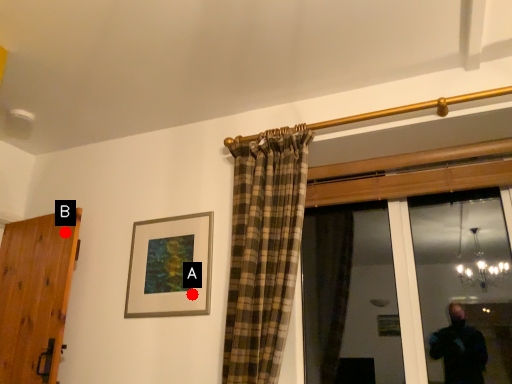
Question: Two points are circled on the image, labeled by A and B beside each circle. Which of the following is the closest to the observer?

Choices:
 (A) A is closer
 (B) B is closer

Answer: (A)